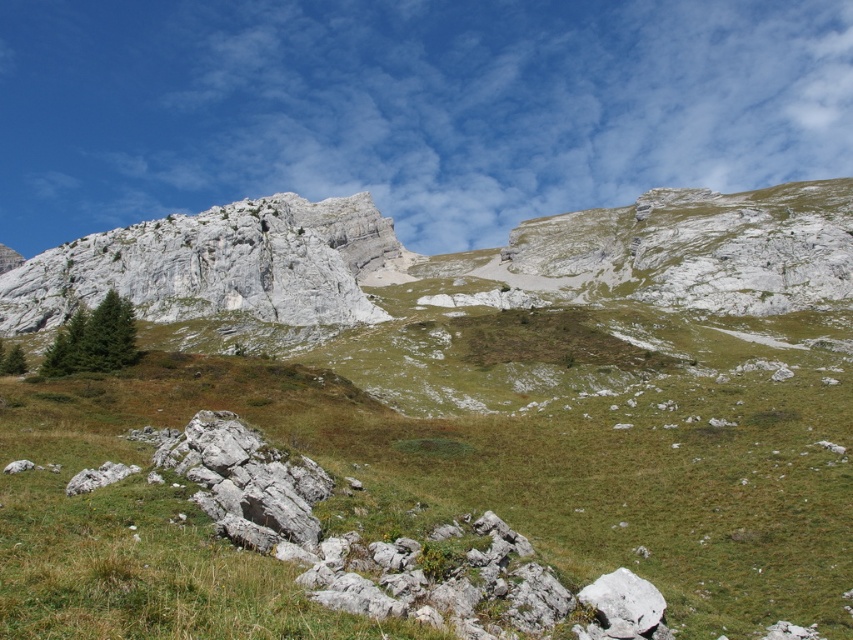
You are planning a hiking route through this mountainous area and need to decide between two paths. One path goes through the green grassy at center, and the other goes over the gray rock formation at upper left. Which path would you choose if you want to take the shorter route?

The green grassy at center occupies less space than the gray rock formation at upper left, so the path through the green grassy at center would be shorter.

You are a hiker planning to climb the mountain. You see the green grassy at center and the gray rock formation at upper left. Which one is located higher up the mountain?

The gray rock formation at upper left is located higher up the mountain than the green grassy at center.